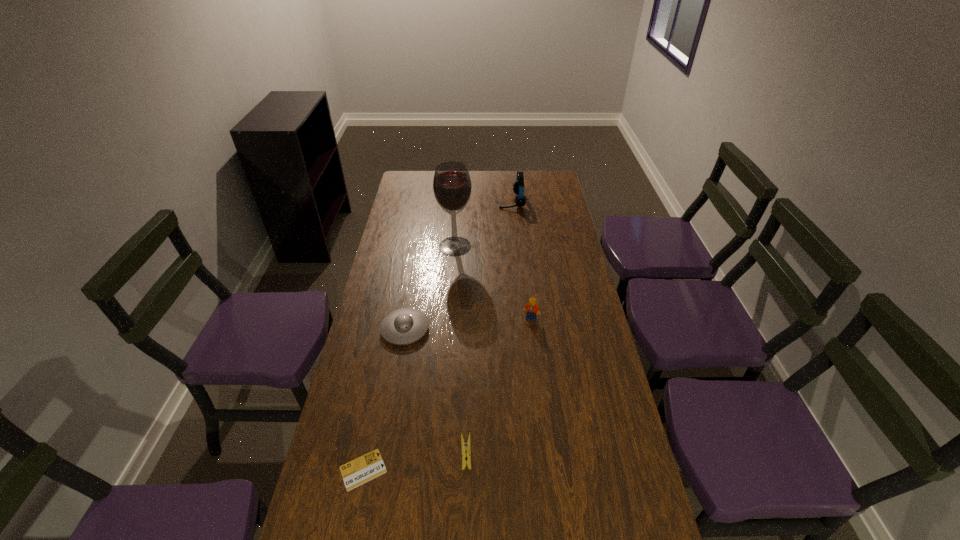
Identify the location of the second farthest object. (452, 186).

Find the location of a particular element. This screenshot has width=960, height=540. alcohol is located at coordinates (452, 186).

At what (x,y) coordinates should I click in order to perform the action: click on the farthest object. Please return your answer as a coordinate pair (x, y). The height and width of the screenshot is (540, 960). Looking at the image, I should click on (518, 187).

This screenshot has width=960, height=540. I want to click on headset, so click(x=518, y=187).

You are a GUI agent. You are given a task and a screenshot of the screen. Output one action in this format:
    pyautogui.click(x=<x>, y=<y>)
    Task: Click on the third tallest object
    Image resolution: width=960 pixels, height=540 pixels.
    Given the screenshot: What is the action you would take?
    pyautogui.click(x=532, y=309)

Where is `the fourth tallest object`? the fourth tallest object is located at coordinates (404, 326).

The width and height of the screenshot is (960, 540). Identify the location of the second shortest object. coord(466,448).

The image size is (960, 540). What are the coordinates of `identity card` in the screenshot? It's located at (369, 466).

Where is `free space located 0.070m on the back of the second farthest object`? This screenshot has height=540, width=960. free space located 0.070m on the back of the second farthest object is located at coordinates (456, 227).

This screenshot has width=960, height=540. In order to click on vacant space located with the microphone attached to the side of the fifth shortest object in this screenshot , I will do `click(424, 201)`.